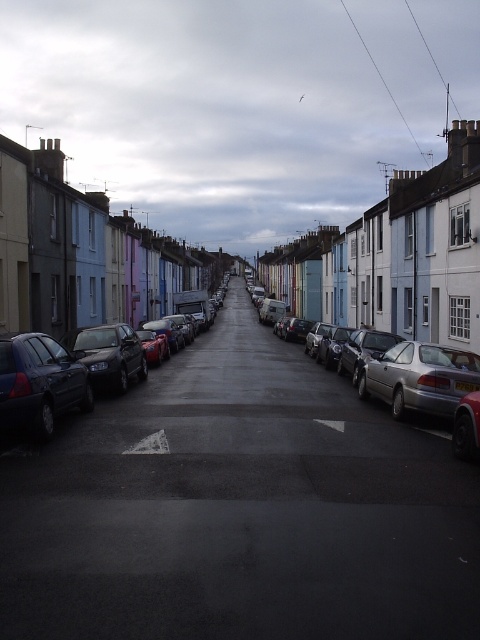
Question: Is silver metallic sedan at center right further to the viewer compared to satin silver sedan at center?

Choices:
 (A) yes
 (B) no

Answer: (B)

Question: Can you confirm if silver metallic sedan at center right is bigger than silver metallic car at right?

Choices:
 (A) no
 (B) yes

Answer: (B)

Question: Among these points, which one is nearest to the camera?

Choices:
 (A) (69, 385)
 (B) (334, 360)
 (C) (379, 348)

Answer: (A)

Question: Which point is closer to the camera?

Choices:
 (A) (450, 364)
 (B) (349, 518)

Answer: (B)

Question: Is the position of smooth asphalt road at center more distant than that of satin silver sedan at center?

Choices:
 (A) yes
 (B) no

Answer: (B)

Question: Which point appears farthest from the camera in this image?

Choices:
 (A) (368, 348)
 (B) (2, 420)
 (C) (408, 461)

Answer: (A)